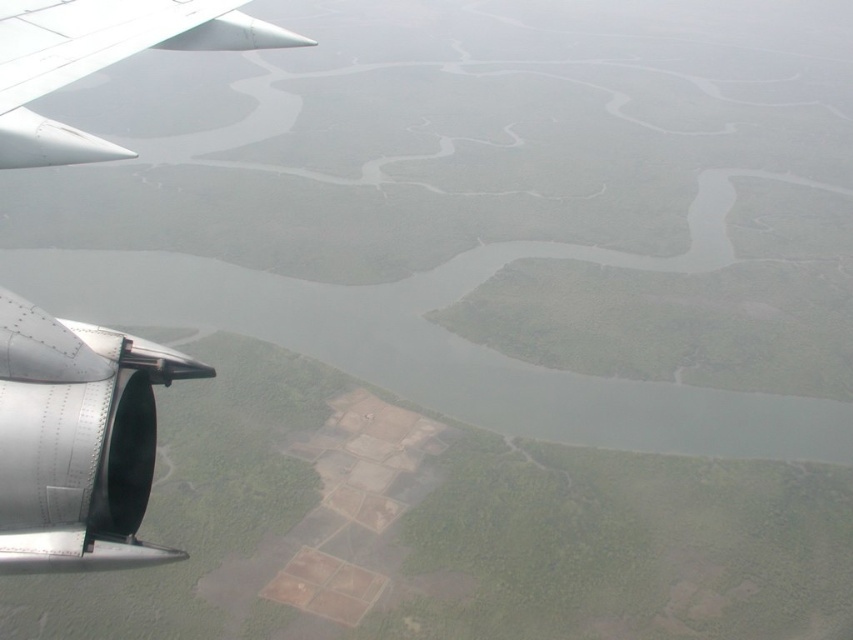
You are a passenger on an airplane and notice a point at coordinate (74, 442) on the window. What object is located at that point?

The point at coordinate (74, 442) indicates the metallic silver wing at upper left.

You are a passenger looking out the airplane window and see the metallic silver wing at upper left and the white matte wing at upper left. Which one is closer to the center of the window?

The metallic silver wing at upper left is closer to the center of the window because it is positioned to the right of the white matte wing at upper left, meaning it is nearer to the middle.

You are a passenger sitting by the window in an airplane. You notice two points marked on the window. The first point is at coordinate point(65, 376) and the second is at point(16, 100). Which point do you think is closer to your view?

Point(65, 376) is closer to the viewer than point(16, 100).